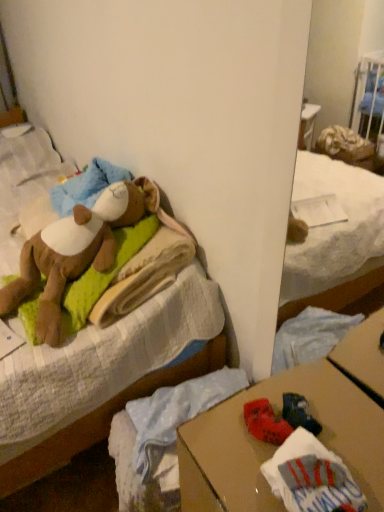
You are a GUI agent. You are given a task and a screenshot of the screen. Output one action in this format:
    pyautogui.click(x=<x>, y=<y>)
    Task: Click on the vacant region above brown cardboard desk at lower right (from a real-world perspective)
    
    Given the screenshot: What is the action you would take?
    pyautogui.click(x=289, y=431)